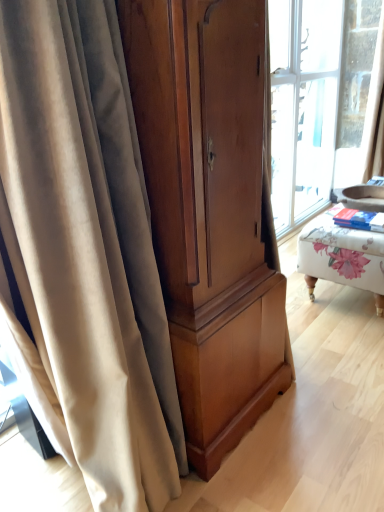
The width and height of the screenshot is (384, 512). What do you see at coordinates (84, 254) in the screenshot? I see `beige velvet curtain at left` at bounding box center [84, 254].

This screenshot has width=384, height=512. Describe the element at coordinates (342, 256) in the screenshot. I see `floral fabric ottoman at right` at that location.

The height and width of the screenshot is (512, 384). Find the location of `matte wood cabinet at center`. matte wood cabinet at center is located at coordinates (209, 210).

Measure the distance between floral fabric ottoman at right and matte wood cabinet at center.

floral fabric ottoman at right is 33.10 inches away from matte wood cabinet at center.

Based on the photo, what's the angular difference between floral fabric ottoman at right and matte wood cabinet at center's facing directions?

0.21 degrees separate the facing orientations of floral fabric ottoman at right and matte wood cabinet at center.

Considering the sizes of objects floral fabric ottoman at right and matte wood cabinet at center in the image provided, who is wider, floral fabric ottoman at right or matte wood cabinet at center?

floral fabric ottoman at right.

Does floral fabric ottoman at right lie in front of matte wood cabinet at center?

No, floral fabric ottoman at right is behind matte wood cabinet at center.

Based on the photo, can floral fabric ottoman at right be found inside matte wood cabinet at center?

No, floral fabric ottoman at right is not surrounded by matte wood cabinet at center.

Which of these two, matte wood cabinet at center or floral fabric ottoman at right, is thinner?

matte wood cabinet at center is thinner.

From the image's perspective, which is above, matte wood cabinet at center or floral fabric ottoman at right?

floral fabric ottoman at right appears higher in the image.

Is matte wood cabinet at center next to floral fabric ottoman at right and touching it?

No, matte wood cabinet at center is not beside floral fabric ottoman at right.

Is matte wood cabinet at center next to beige velvet curtain at left?

No, matte wood cabinet at center is not touching beige velvet curtain at left.

Considering the relative sizes of matte wood cabinet at center and beige velvet curtain at left in the image provided, is matte wood cabinet at center smaller than beige velvet curtain at left?

Actually, matte wood cabinet at center might be larger than beige velvet curtain at left.

Considering the sizes of matte wood cabinet at center and beige velvet curtain at left in the image, is matte wood cabinet at center wider or thinner than beige velvet curtain at left?

matte wood cabinet at center is thinner than beige velvet curtain at left.

Is matte wood cabinet at center outside of beige velvet curtain at left?

Yes, matte wood cabinet at center is located beyond the bounds of beige velvet curtain at left.

Would you consider floral fabric ottoman at right to be distant from beige velvet curtain at left?

floral fabric ottoman at right is far away from beige velvet curtain at left.

Can beige velvet curtain at left be found inside floral fabric ottoman at right?

Definitely not — beige velvet curtain at left is not inside floral fabric ottoman at right.

From a real-world perspective, is floral fabric ottoman at right physically located above or below beige velvet curtain at left?

floral fabric ottoman at right is situated lower than beige velvet curtain at left in the real world.

Which of these two, beige velvet curtain at left or matte wood cabinet at center, is bigger?

With larger size is matte wood cabinet at center.

Locate an element on the screen. The image size is (384, 512). cabinetry behind the beige velvet curtain at left is located at coordinates (209, 210).

Is beige velvet curtain at left positioned far away from matte wood cabinet at center?

Actually, beige velvet curtain at left and matte wood cabinet at center are a little close together.

Considering the relative sizes of beige velvet curtain at left and matte wood cabinet at center in the image provided, is beige velvet curtain at left thinner than matte wood cabinet at center?

No, beige velvet curtain at left is not thinner than matte wood cabinet at center.

Is beige velvet curtain at left far from floral fabric ottoman at right?

Indeed, beige velvet curtain at left is not near floral fabric ottoman at right.

Consider the image. Is beige velvet curtain at left wider or thinner than floral fabric ottoman at right?

Considering their sizes, beige velvet curtain at left looks slimmer than floral fabric ottoman at right.

The image size is (384, 512). Identify the location of curtain below the floral fabric ottoman at right (from the image's perspective). (84, 254).

Locate an element on the screen. furniture behind the matte wood cabinet at center is located at coordinates (342, 256).

Image resolution: width=384 pixels, height=512 pixels. What are the coordinates of `furniture below the matte wood cabinet at center (from a real-world perspective)` in the screenshot? It's located at (x=342, y=256).

From the image, which object appears to be nearer to floral fabric ottoman at right, matte wood cabinet at center or beige velvet curtain at left?

matte wood cabinet at center.

Which object lies nearer to the anchor point beige velvet curtain at left, floral fabric ottoman at right or matte wood cabinet at center?

matte wood cabinet at center is positioned closer to the anchor beige velvet curtain at left.

When comparing their distances from matte wood cabinet at center, does floral fabric ottoman at right or beige velvet curtain at left seem closer?

beige velvet curtain at left.

Based on their spatial positions, is matte wood cabinet at center or floral fabric ottoman at right further from beige velvet curtain at left?

floral fabric ottoman at right.

In the scene shown: Which object lies nearer to the anchor point matte wood cabinet at center, beige velvet curtain at left or floral fabric ottoman at right?

Among the two, beige velvet curtain at left is located nearer to matte wood cabinet at center.

Which object lies further to the anchor point floral fabric ottoman at right, beige velvet curtain at left or matte wood cabinet at center?

beige velvet curtain at left lies further to floral fabric ottoman at right than the other object.

The height and width of the screenshot is (512, 384). I want to click on cabinetry between beige velvet curtain at left and floral fabric ottoman at right from front to back, so click(x=209, y=210).